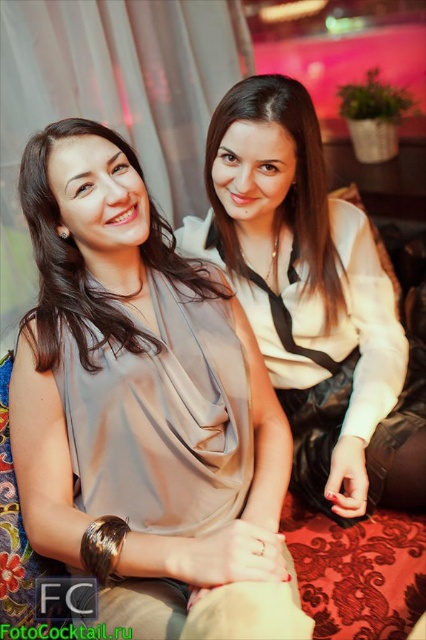
You are standing in front of the two women in the image. You want to place a small gift between them so that it is equally accessible to both. Considering their positions, which point should you choose, point A at coordinates point (103, 161) or point B at coordinates point (46, 317)?

You should choose point B at coordinates point (46, 317) because it is farther from the viewer, allowing both women to reach it easily without leaning too far forward.

You are a photographer trying to capture the scene of two women in a cozy indoor setting. You notice a point at coordinates (85, 262). Based on the scene description, what object does this point most likely belong to?

The point at coordinates (85, 262) corresponds to the satin beige blouse at left.